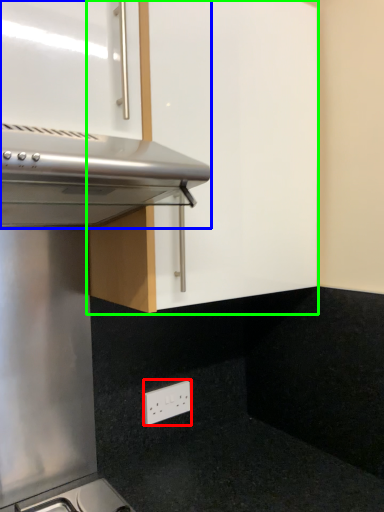
Question: Which is farther away from electric outlet (highlighted by a red box)? oven (highlighted by a blue box) or cabinetry (highlighted by a green box)?

Choices:
 (A) oven
 (B) cabinetry

Answer: (A)